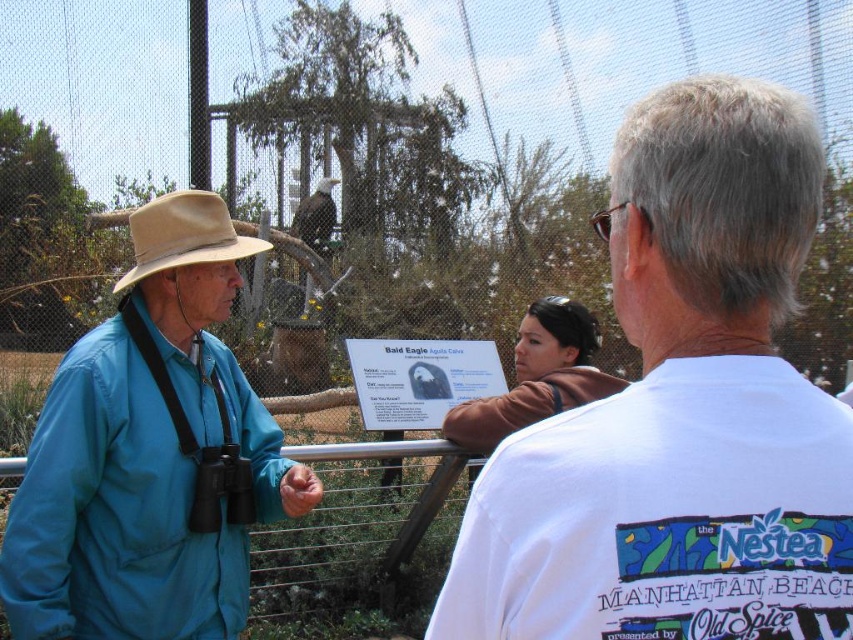
You are a visitor at the sanctuary and want to take a photo of the bald eagle in the enclosure. You have a camera with a zoom lens. The brushed metal rail at center might block your view. Is the beige felt cowboy hat at left also blocking your view of the eagle?

The beige felt cowboy hat at left is in front of the brushed metal rail at center, so the hat would block your view before the rail does. You should move to the side to avoid both obstructions.

You are a visitor at the sanctuary and want to know if the beige felt cowboy hat at left can fit inside the brushed metal rail at center. Can it?

The beige felt cowboy hat at left has a smaller size compared to brushed metal rail at center, so yes, the hat can fit inside the rail.

You are standing at the center of the image. Which direction should you move to locate the white cotton shirt at upper right?

To locate the white cotton shirt at upper right, you should move towards the upper right direction from your current position at the center.